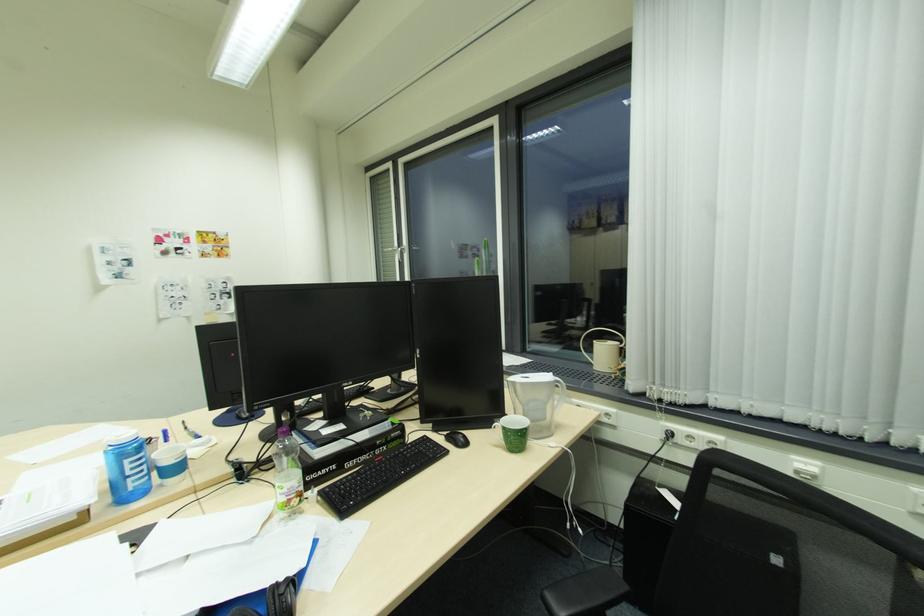
The height and width of the screenshot is (616, 924). What are the coordinates of `silver window handle` in the screenshot? It's located at (394, 249).